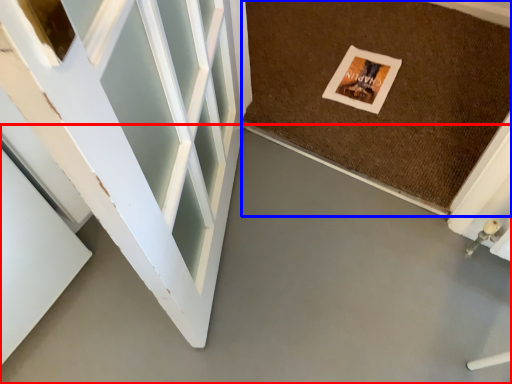
Question: Which of the following is the farthest to the observer, concrete (highlighted by a red box) or mat (highlighted by a blue box)?

Choices:
 (A) concrete
 (B) mat

Answer: (B)